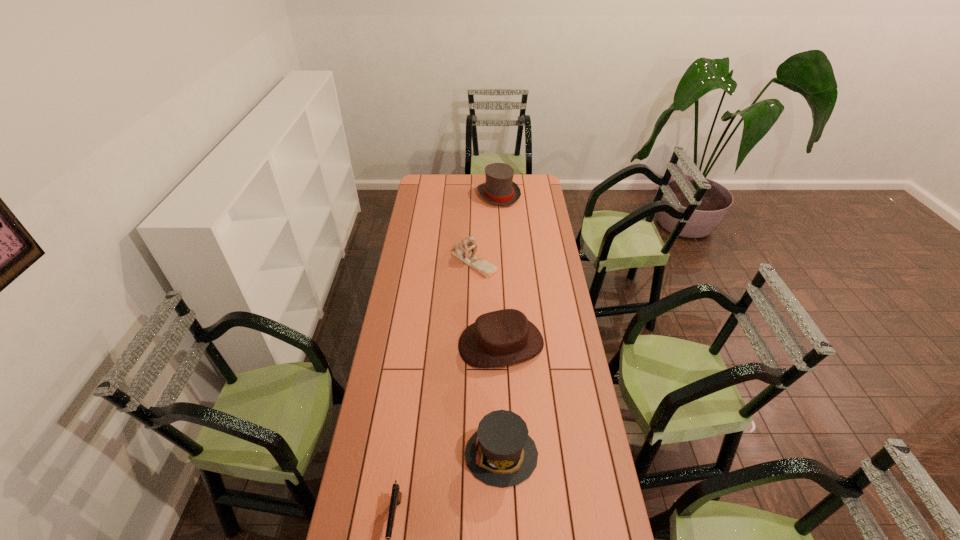
The height and width of the screenshot is (540, 960). I want to click on the closest hat relative to the figurine, so click(x=504, y=337).

You are a GUI agent. You are given a task and a screenshot of the screen. Output one action in this format:
    pyautogui.click(x=<x>, y=<y>)
    Task: Click on the vacant position in the image that satisfies the following two spatial constraints: 1. on the front side of the second farthest hat; 2. with goggles on the front of the nearest hat
    This screenshot has height=540, width=960.
    Given the screenshot: What is the action you would take?
    pyautogui.click(x=506, y=455)